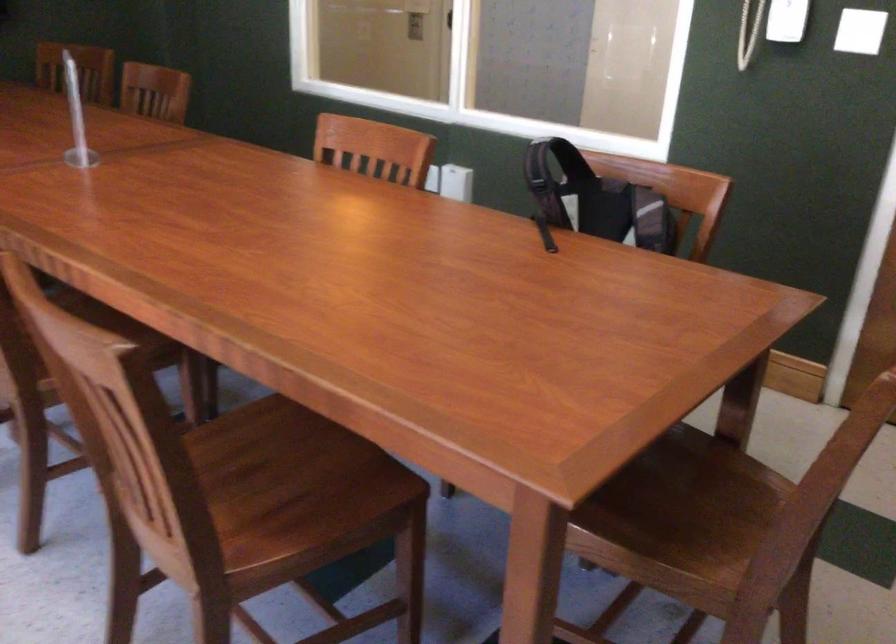
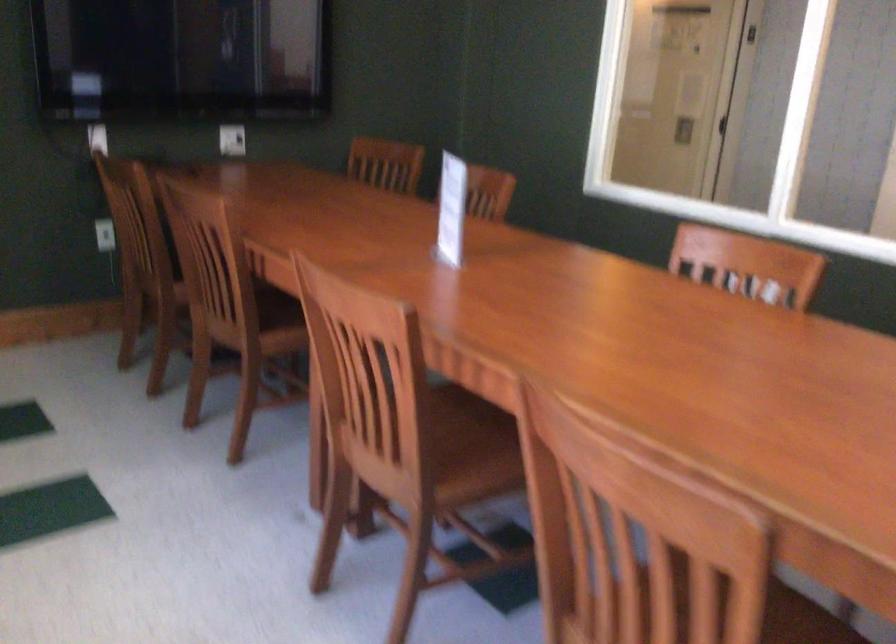
The point at (149, 422) is marked in the first image. Where is the corresponding point in the second image?

(709, 588)